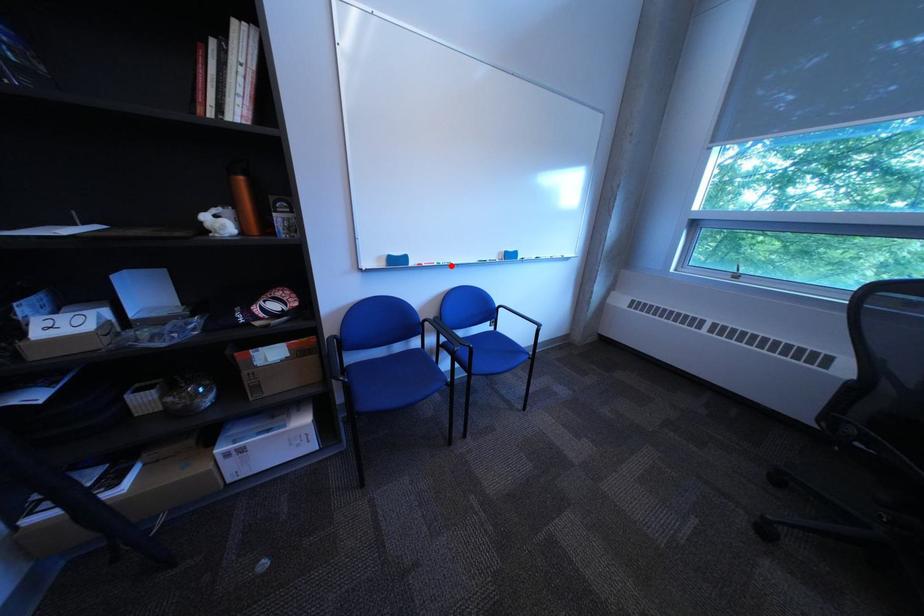
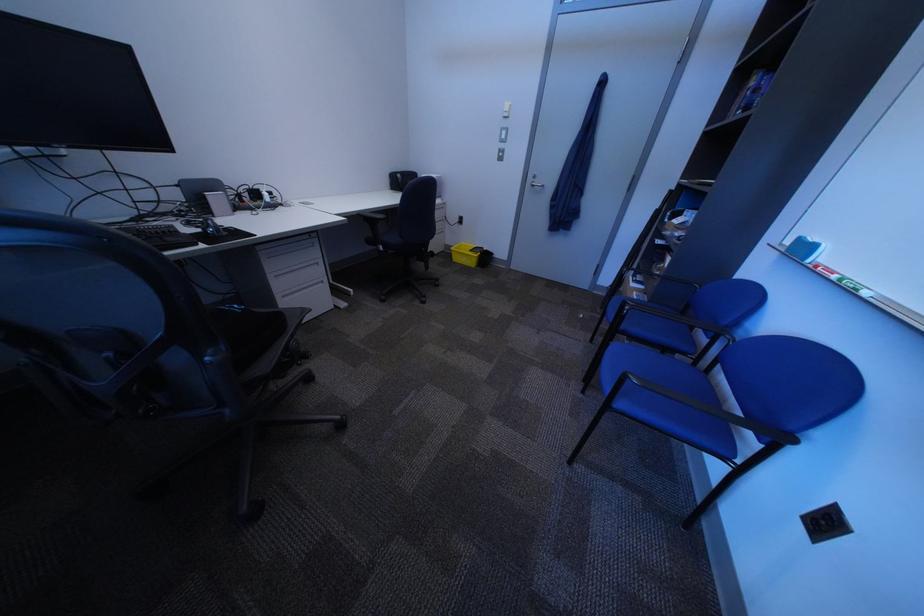
Find the pixel in the second image that matches the highlighted location in the first image.

(849, 278)